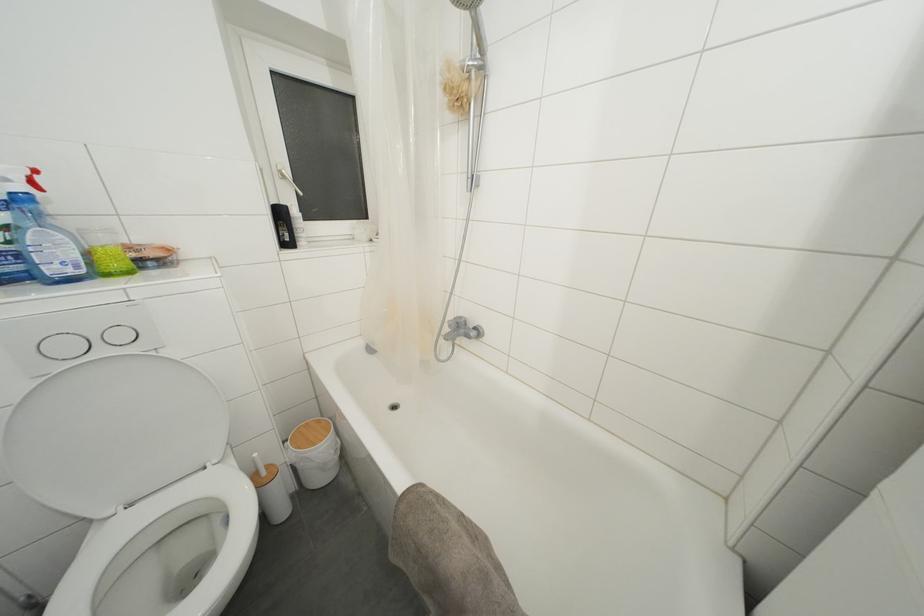
Find where to lift the toilet brush handle. Please return your answer as a coordinate pair (x, y).

(258, 464)